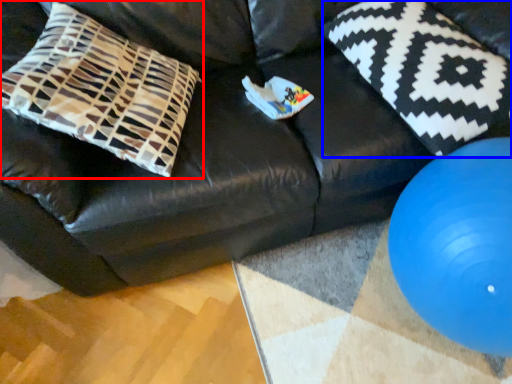
Question: Which object is closer to the camera taking this photo, pillow (highlighted by a red box) or pillow (highlighted by a blue box)?

Choices:
 (A) pillow
 (B) pillow

Answer: (A)